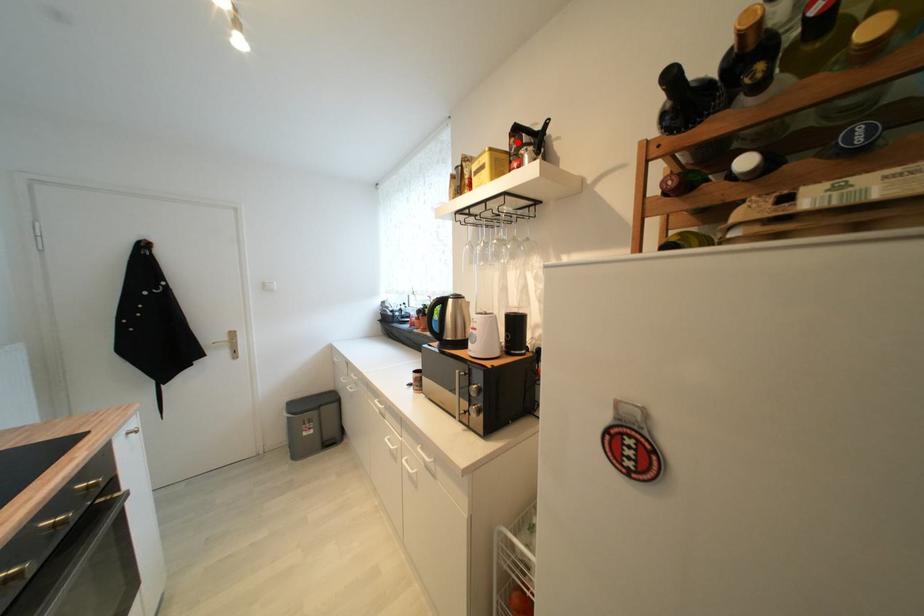
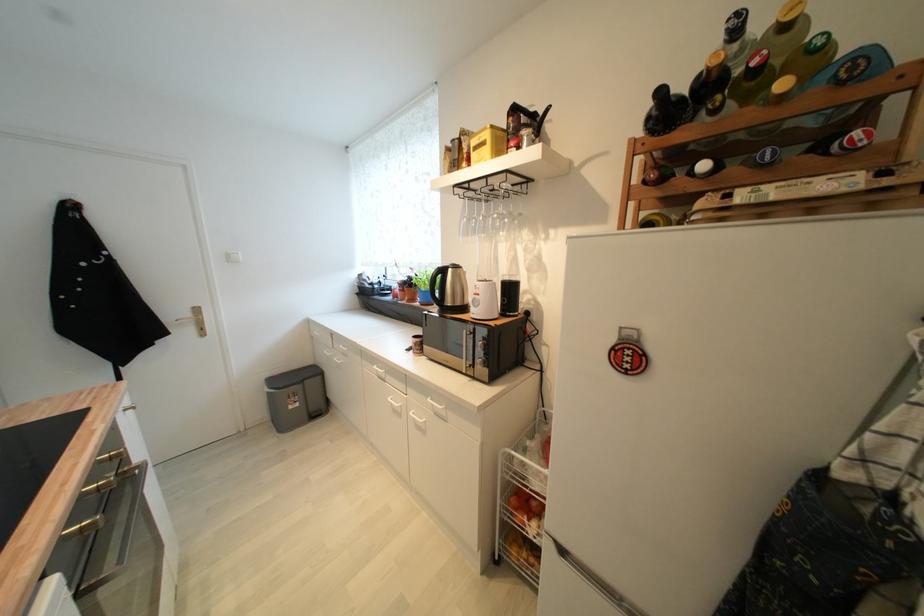
Locate, in the second image, the point that corresponds to the highlighted location in the first image.

(516, 121)